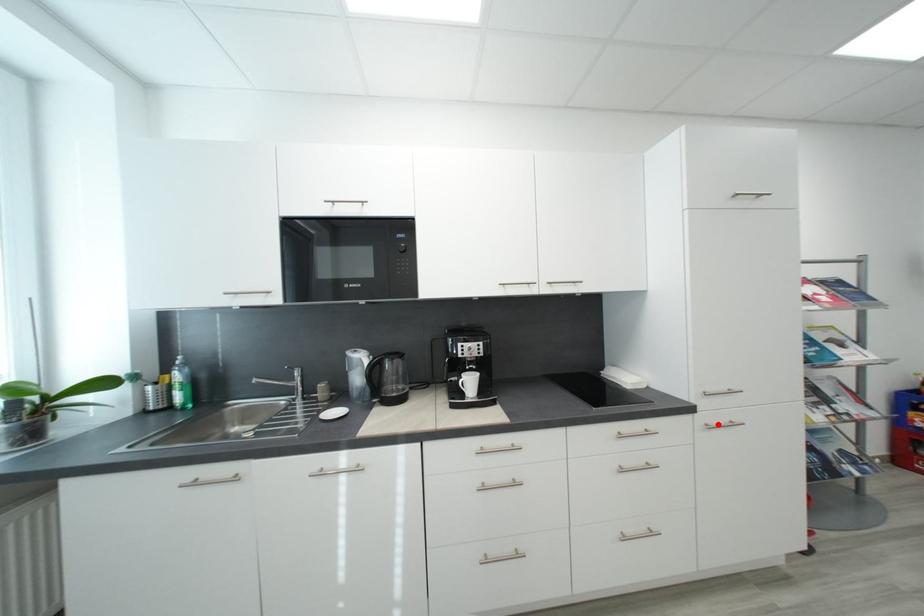
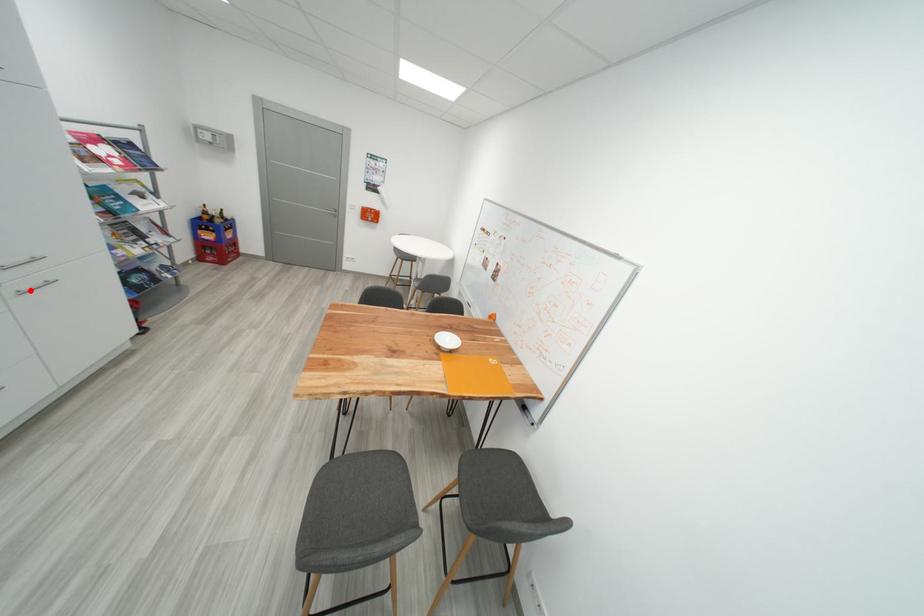
I am providing you with two images of the same scene from different viewpoints. A red point is marked on the first image and another point is marked on the second image. Does the point marked in image1 correspond to the same location as the one in image2?

Yes